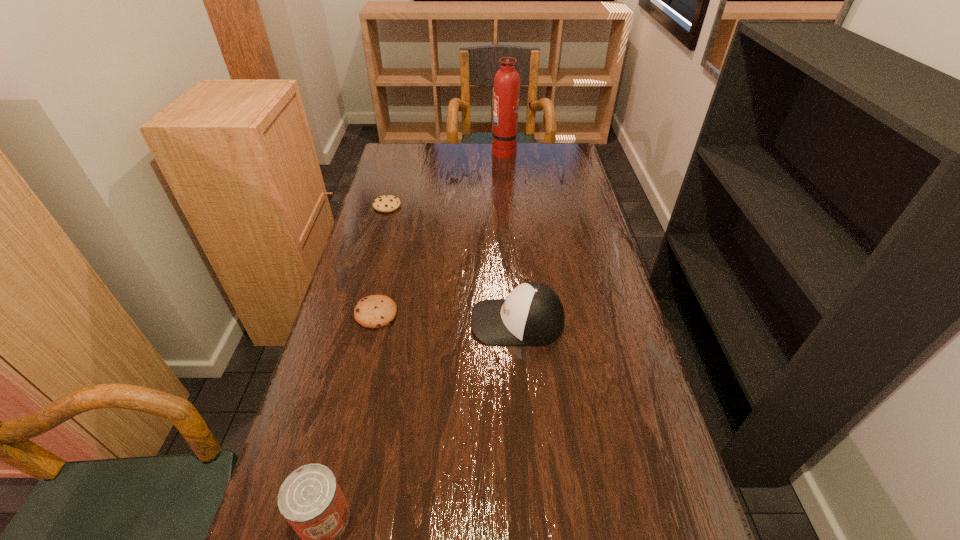
The width and height of the screenshot is (960, 540). What are the coordinates of `fire extinguisher` in the screenshot? It's located at click(x=507, y=80).

You are a GUI agent. You are given a task and a screenshot of the screen. Output one action in this format:
    pyautogui.click(x=<x>, y=<y>)
    Task: Click on the farthest object
    
    Given the screenshot: What is the action you would take?
    pyautogui.click(x=507, y=80)

At what (x,y) coordinates should I click in order to perform the action: click on cap. Please return your answer as a coordinate pair (x, y). This screenshot has height=540, width=960. Looking at the image, I should click on (532, 314).

I want to click on the farther cookie, so click(387, 203).

At what (x,y) coordinates should I click in order to perform the action: click on the nearer cookie. Please return your answer as a coordinate pair (x, y). Image resolution: width=960 pixels, height=540 pixels. Looking at the image, I should click on (375, 311).

The height and width of the screenshot is (540, 960). Find the location of `free space located on the label side of the fire extinguisher`. free space located on the label side of the fire extinguisher is located at coordinates pos(455,151).

This screenshot has height=540, width=960. What are the coordinates of `free space located 0.360m on the label side of the fire extinguisher` in the screenshot? It's located at (404, 151).

The width and height of the screenshot is (960, 540). In order to click on vacant space situated on the label side of the fire extinguisher in this screenshot , I will do `click(404, 151)`.

Where is `vacant space located on the front panel of the cap`? This screenshot has height=540, width=960. vacant space located on the front panel of the cap is located at coordinates (420, 322).

The height and width of the screenshot is (540, 960). What are the coordinates of `vacant space located 0.080m on the front panel of the cap` in the screenshot? It's located at (440, 322).